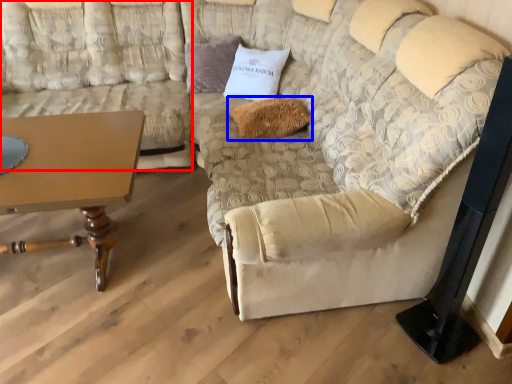
Question: Which point is further to the camera, couch (highlighted by a red box) or pillow (highlighted by a blue box)?

Choices:
 (A) couch
 (B) pillow

Answer: (B)